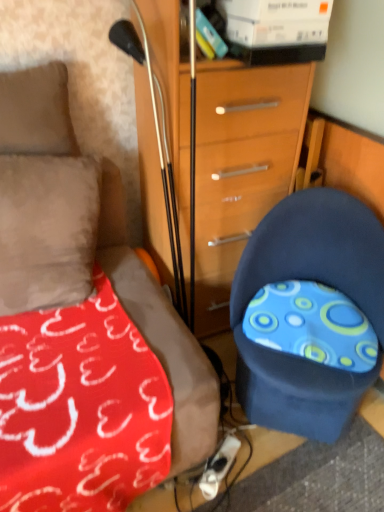
Question: Considering their positions, is blue fabric chair at lower right located in front of or behind suede-like beige pillow at upper left?

Choices:
 (A) front
 (B) behind

Answer: (A)

Question: In terms of height, does blue fabric chair at lower right look taller or shorter compared to suede-like beige pillow at upper left?

Choices:
 (A) short
 (B) tall

Answer: (B)

Question: Which of these objects is positioned closest to the wooden chest of drawers at center?

Choices:
 (A) suede-like beige pillow at upper left
 (B) blue fabric chair at lower right

Answer: (B)

Question: Based on their relative distances, which object is farther from the blue fabric chair at lower right?

Choices:
 (A) wooden chest of drawers at center
 (B) suede-like beige pillow at upper left

Answer: (B)